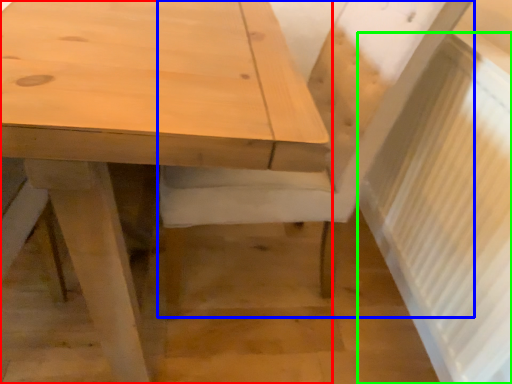
Question: Which object is the farthest from table (highlighted by a red box)? Choose among these: chair (highlighted by a blue box) or radiator (highlighted by a green box).

Choices:
 (A) chair
 (B) radiator

Answer: (B)